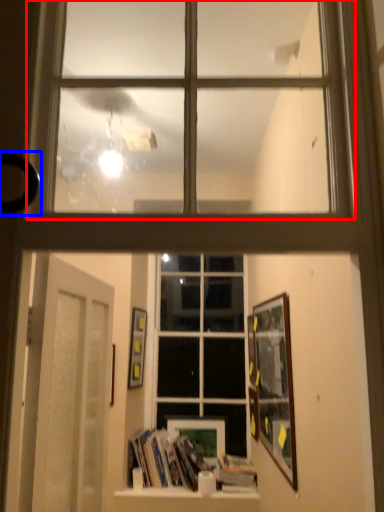
Question: Which point is further to the camera, window (highlighted by a red box) or door handle (highlighted by a blue box)?

Choices:
 (A) window
 (B) door handle

Answer: (A)